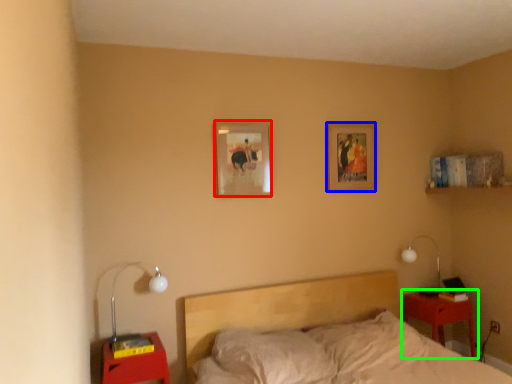
Question: Considering the real-world distances, which object is closest to picture frame (highlighted by a red box)? picture frame (highlighted by a blue box) or nightstand (highlighted by a green box).

Choices:
 (A) picture frame
 (B) nightstand

Answer: (A)